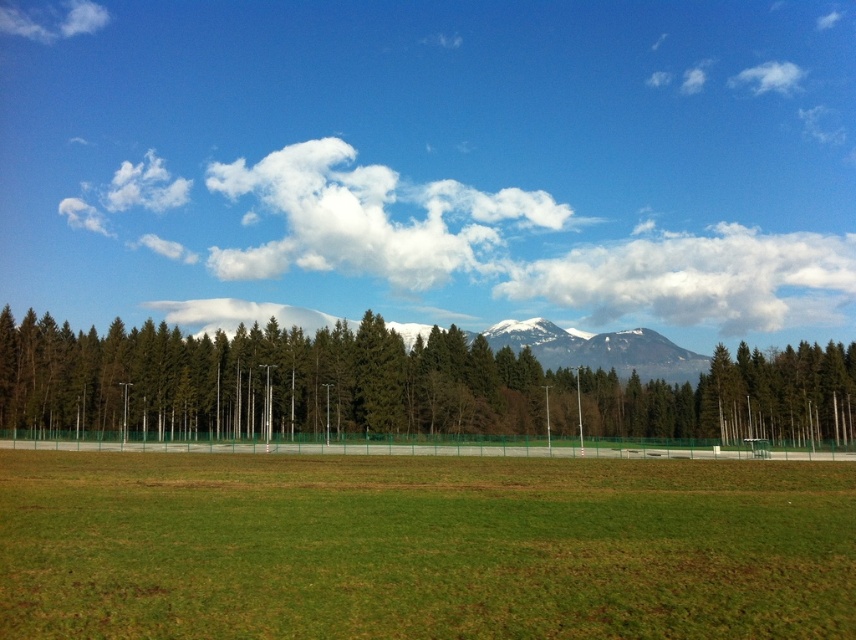
Describe the element at coordinates (421, 547) in the screenshot. I see `green grass field at center` at that location.

Who is shorter, green grass field at center or white fluffy cloud at upper left?

green grass field at center

Locate an element on the screen. green grass field at center is located at coordinates (421, 547).

Between point (831, 612) and point (526, 262), which one is positioned in front?

Positioned in front is point (831, 612).

Which is below, green grass field at center or white fluffy cloud at upper center?

Positioned lower is green grass field at center.

Where is `green grass field at center`? This screenshot has width=856, height=640. green grass field at center is located at coordinates (421, 547).

Measure the distance between green textured trees at center and camera.

95.30 meters

Where is `green textured trees at center`? The height and width of the screenshot is (640, 856). green textured trees at center is located at coordinates (271, 380).